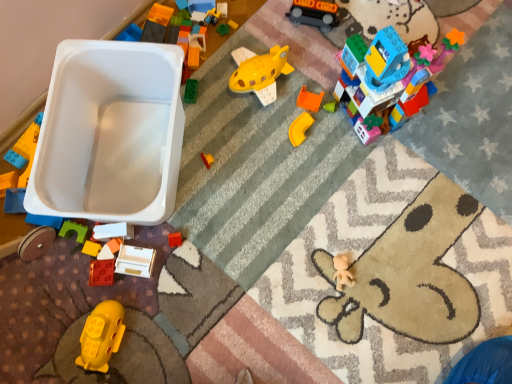
This screenshot has width=512, height=384. I want to click on vacant space that is to the left of multicolored plastic building block at upper right, which appears as the seventh toy when ordered from the bottom, so click(308, 113).